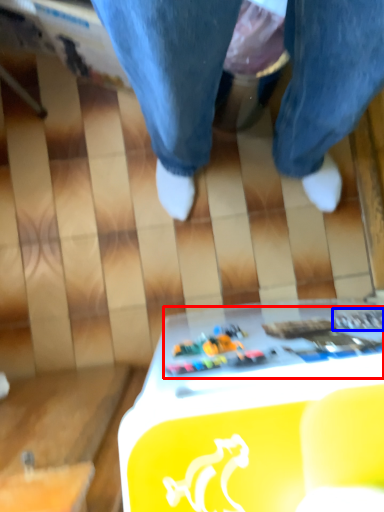
Question: Which object appears closest to the camera in this image, writing (highlighted by a red box) or writing (highlighted by a blue box)?

Choices:
 (A) writing
 (B) writing

Answer: (A)